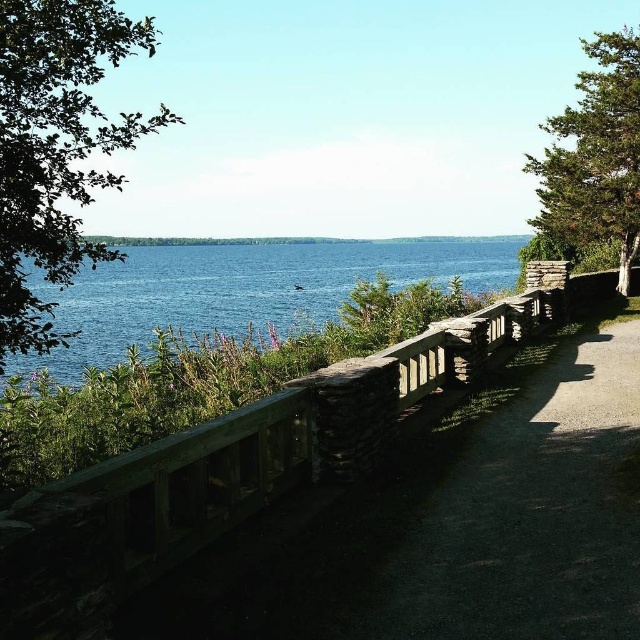
Question: Which point is closer to the camera?

Choices:
 (A) blue water at center
 (B) wooden path at center

Answer: (B)

Question: Which of the following is the closest to the observer?

Choices:
 (A) (104, 289)
 (B) (596, 182)
 (C) (61, 17)
 (D) (604, 460)

Answer: (C)

Question: Is wooden path at center positioned in front of blue water at center?

Choices:
 (A) yes
 (B) no

Answer: (A)

Question: Can you confirm if green leafy tree at upper left is positioned above blue water at center?

Choices:
 (A) yes
 (B) no

Answer: (A)

Question: Can you confirm if wooden path at center is positioned to the right of green textured tree at upper right?

Choices:
 (A) no
 (B) yes

Answer: (A)

Question: Estimate the real-world distances between objects in this image. Which object is farther from the blue water at center?

Choices:
 (A) green leafy tree at upper left
 (B) green textured tree at upper right
 (C) wooden path at center

Answer: (C)